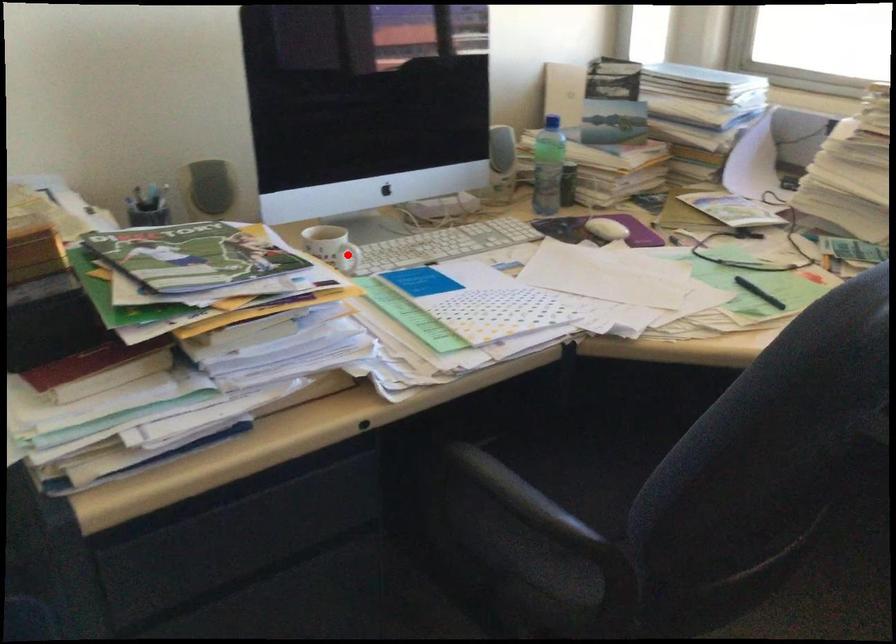
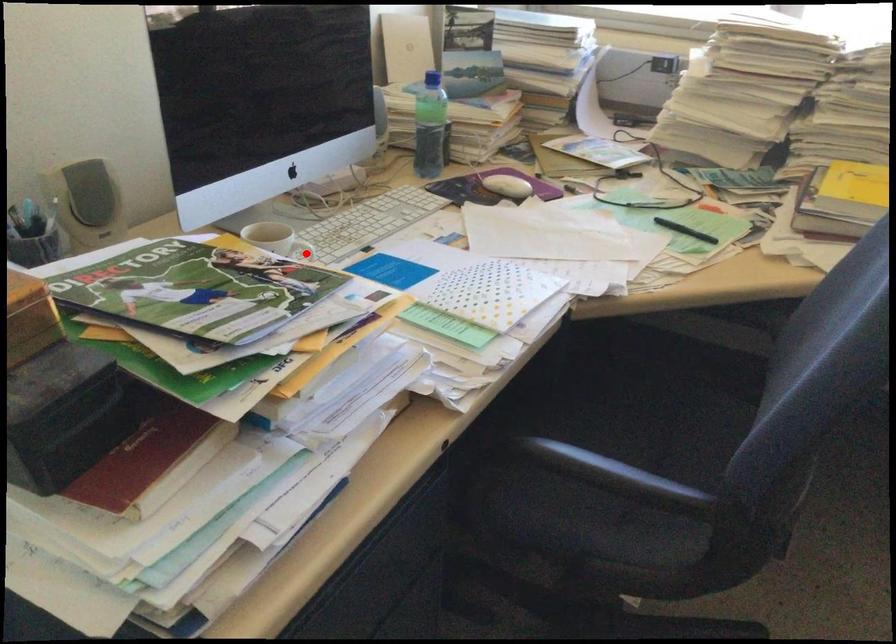
I am providing you with two images of the same scene from different viewpoints. A red point is marked on the first image and another point is marked on the second image. Does the point marked in image1 correspond to the same location as the one in image2?

Yes